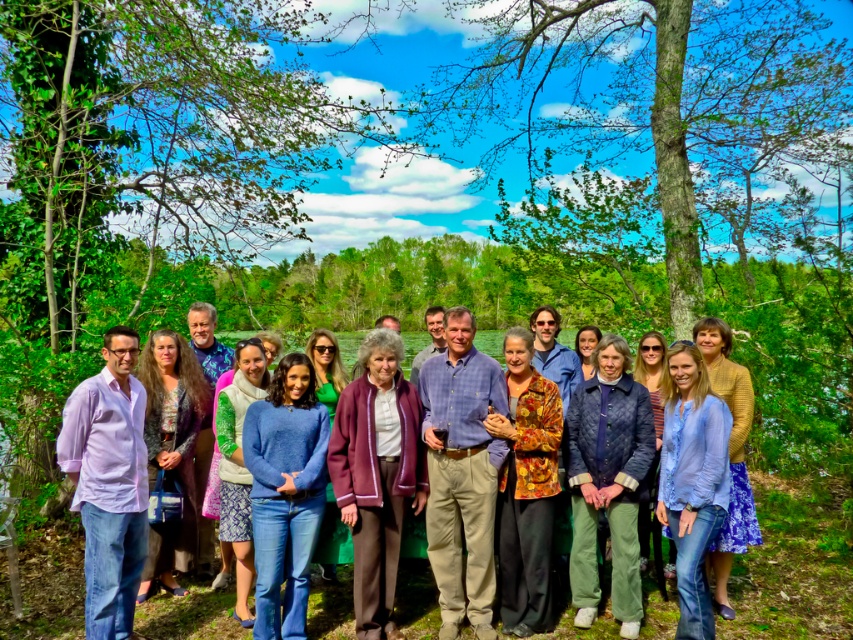
Question: Is light purple cotton shirt at left to the left of quilted blue jacket at center from the viewer's perspective?

Choices:
 (A) yes
 (B) no

Answer: (A)

Question: Is light purple cotton shirt at left positioned before blue knitted sweater at center?

Choices:
 (A) no
 (B) yes

Answer: (B)

Question: Which object is the farthest from the blue knitted sweater at center?

Choices:
 (A) blue cotton sweater at center
 (B) blue cotton shirt at center
 (C) floral-patterned fabric at center
 (D) quilted blue jacket at center

Answer: (A)

Question: Which is farther from the blue cotton shirt at center?

Choices:
 (A) green leafy tree at center
 (B) purple woolen sweater at center

Answer: (A)

Question: Is floral-patterned fabric at center to the right of textured gray sweater at center from the viewer's perspective?

Choices:
 (A) yes
 (B) no

Answer: (A)

Question: Among these points, which one is nearest to the camera?

Choices:
 (A) (447, 464)
 (B) (717, 592)
 (C) (357, 627)
 (D) (126, 426)

Answer: (D)